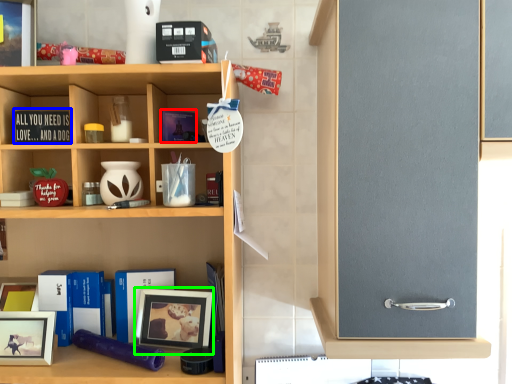
Question: Considering the real-world distances, which object is farthest from book (highlighted by a red box)? book (highlighted by a blue box) or picture frame (highlighted by a green box)?

Choices:
 (A) book
 (B) picture frame

Answer: (B)